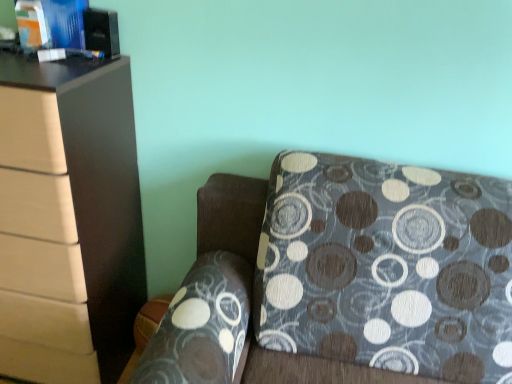
Question: Should I look upward or downward to see matte blue book at upper left, which is counted as the 2th book, starting from the right?

Choices:
 (A) up
 (B) down

Answer: (A)

Question: Are matte blue book at upper left, which appears as the 1th book when viewed from the left, and matte brown chest of drawers at left making contact?

Choices:
 (A) no
 (B) yes

Answer: (A)

Question: Can you confirm if matte blue book at upper left, which is counted as the 2th book, starting from the right, is wider than matte brown chest of drawers at left?

Choices:
 (A) yes
 (B) no

Answer: (B)

Question: Is matte blue book at upper left, which appears as the 1th book when viewed from the left, turned away from matte brown chest of drawers at left?

Choices:
 (A) yes
 (B) no

Answer: (B)

Question: Is matte blue book at upper left, which appears as the 1th book when viewed from the left, at the right side of matte brown chest of drawers at left?

Choices:
 (A) no
 (B) yes

Answer: (B)

Question: Is the position of matte blue book at upper left, which is counted as the 2th book, starting from the right, less distant than that of matte brown chest of drawers at left?

Choices:
 (A) yes
 (B) no

Answer: (B)

Question: Does matte blue book at upper left, which is counted as the 2th book, starting from the right, have a lesser height compared to matte brown chest of drawers at left?

Choices:
 (A) yes
 (B) no

Answer: (A)

Question: Is patterned fabric couch at lower right located outside matte blue book at upper left, which appears as the 1th book when viewed from the left?

Choices:
 (A) no
 (B) yes

Answer: (B)

Question: From a real-world perspective, is patterned fabric couch at lower right on matte blue book at upper left, which appears as the 1th book when viewed from the left?

Choices:
 (A) no
 (B) yes

Answer: (A)

Question: Considering the relative sizes of patterned fabric couch at lower right and matte blue book at upper left, which appears as the 1th book when viewed from the left, in the image provided, is patterned fabric couch at lower right smaller than matte blue book at upper left, which appears as the 1th book when viewed from the left,?

Choices:
 (A) no
 (B) yes

Answer: (A)

Question: Are patterned fabric couch at lower right and matte blue book at upper left, which is counted as the 2th book, starting from the right, far apart?

Choices:
 (A) yes
 (B) no

Answer: (B)

Question: Does patterned fabric couch at lower right appear on the right side of matte blue book at upper left, which is counted as the 2th book, starting from the right?

Choices:
 (A) no
 (B) yes

Answer: (B)

Question: Does patterned fabric couch at lower right contain matte blue book at upper left, which is counted as the 2th book, starting from the right?

Choices:
 (A) yes
 (B) no

Answer: (B)

Question: Is matte brown chest of drawers at left at the right side of matte blue book at upper left, which is counted as the 2th book, starting from the right?

Choices:
 (A) no
 (B) yes

Answer: (A)